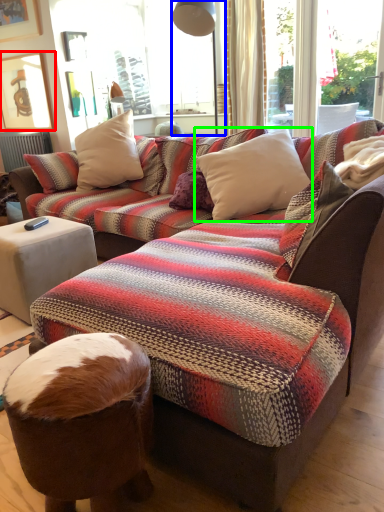
Question: Considering the real-world distances, which object is closest to picture frame (highlighted by a red box)? lamp (highlighted by a blue box) or pillow (highlighted by a green box).

Choices:
 (A) lamp
 (B) pillow

Answer: (A)